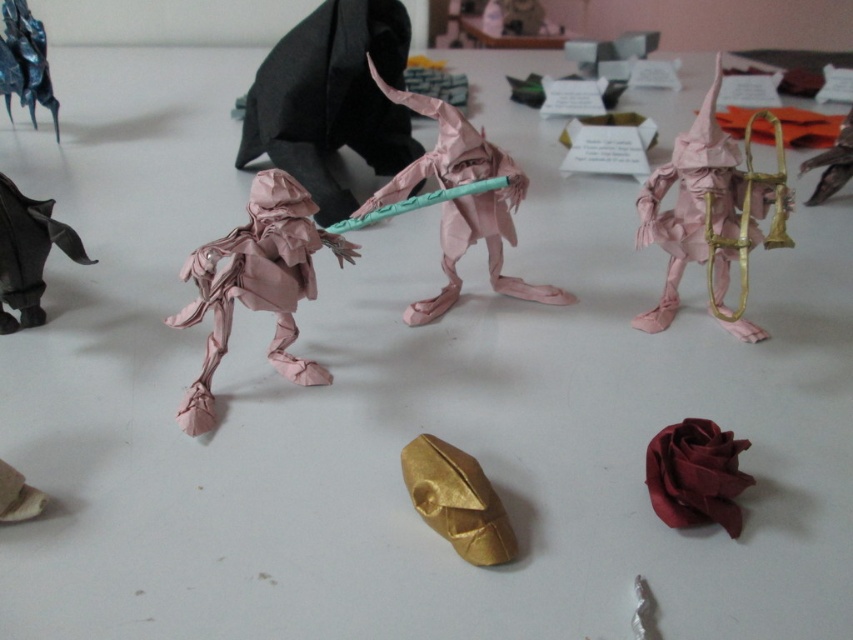
Question: Which object is farther from the camera taking this photo?

Choices:
 (A) pink paper bird at center
 (B) matte red paper rose at lower right

Answer: (A)

Question: Which of the following is the farthest from the observer?

Choices:
 (A) (370, 150)
 (B) (512, 168)
 (C) (9, 64)

Answer: (C)

Question: Which point is closer to the camera?

Choices:
 (A) shiny black origami at upper left
 (B) matte pink paper at center
 (C) gold metallic helmet at center

Answer: (C)

Question: Does pink paper wizard at upper right have a larger size compared to matte black origami figure at left?

Choices:
 (A) no
 (B) yes

Answer: (B)

Question: Can you confirm if matte pink paper at center is positioned below matte red paper rose at lower right?

Choices:
 (A) no
 (B) yes

Answer: (A)

Question: Is matte pink paper at center positioned at the back of gold metallic helmet at center?

Choices:
 (A) no
 (B) yes

Answer: (B)